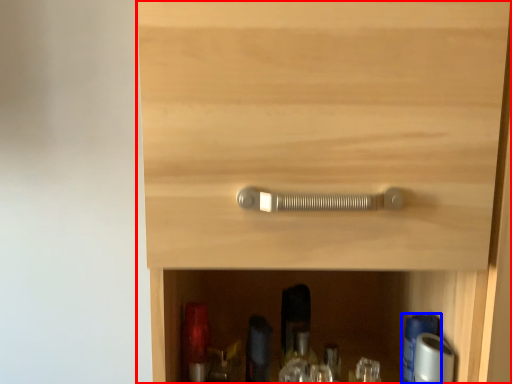
Question: Among these objects, which one is farthest to the camera, cupboard (highlighted by a red box) or bottle (highlighted by a blue box)?

Choices:
 (A) cupboard
 (B) bottle

Answer: (B)